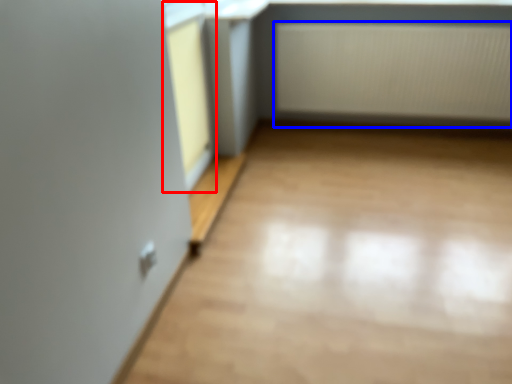
Question: Which object is closer to the camera taking this photo, window frame (highlighted by a red box) or radiator (highlighted by a blue box)?

Choices:
 (A) window frame
 (B) radiator

Answer: (A)